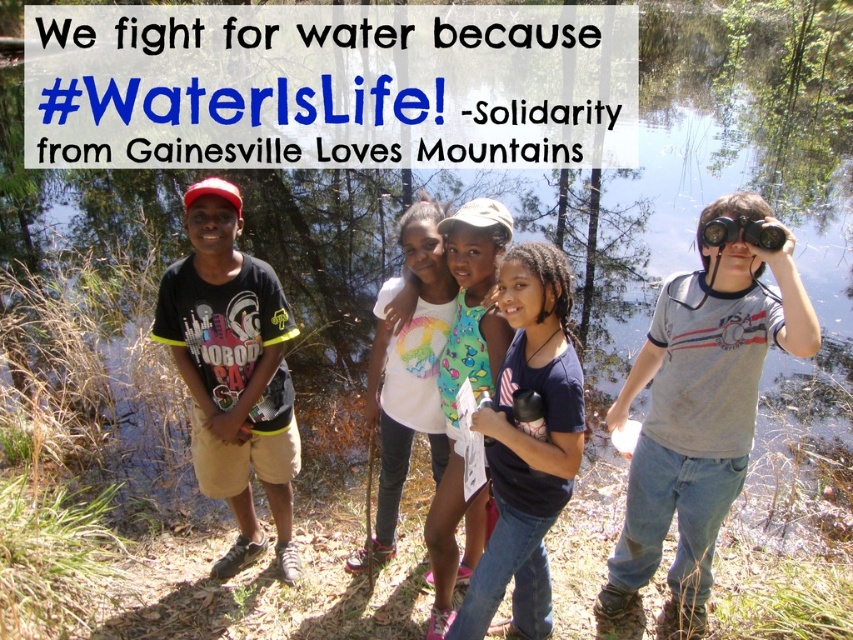
Does white cotton shirt at center appear on the right side of rainbow printed tank top at center?

Incorrect, white cotton shirt at center is not on the right side of rainbow printed tank top at center.

Between white cotton shirt at center and rainbow printed tank top at center, which one appears on the left side from the viewer's perspective?

From the viewer's perspective, white cotton shirt at center appears more on the left side.

This screenshot has height=640, width=853. Describe the element at coordinates (407, 372) in the screenshot. I see `white cotton shirt at center` at that location.

At what (x,y) coordinates should I click in order to perform the action: click on white cotton shirt at center. Please return your answer as a coordinate pair (x, y). This screenshot has height=640, width=853. Looking at the image, I should click on (407, 372).

Is gray cotton binoculars at right smaller than white cotton shirt at center?

No, gray cotton binoculars at right is not smaller than white cotton shirt at center.

Can you confirm if gray cotton binoculars at right is taller than white cotton shirt at center?

Yes, gray cotton binoculars at right is taller than white cotton shirt at center.

Identify the location of gray cotton binoculars at right. This screenshot has width=853, height=640. (701, 404).

From the picture: Does gray cotton binoculars at right appear over rainbow printed tank top at center?

No.

The image size is (853, 640). I want to click on gray cotton binoculars at right, so click(701, 404).

I want to click on gray cotton binoculars at right, so click(x=701, y=404).